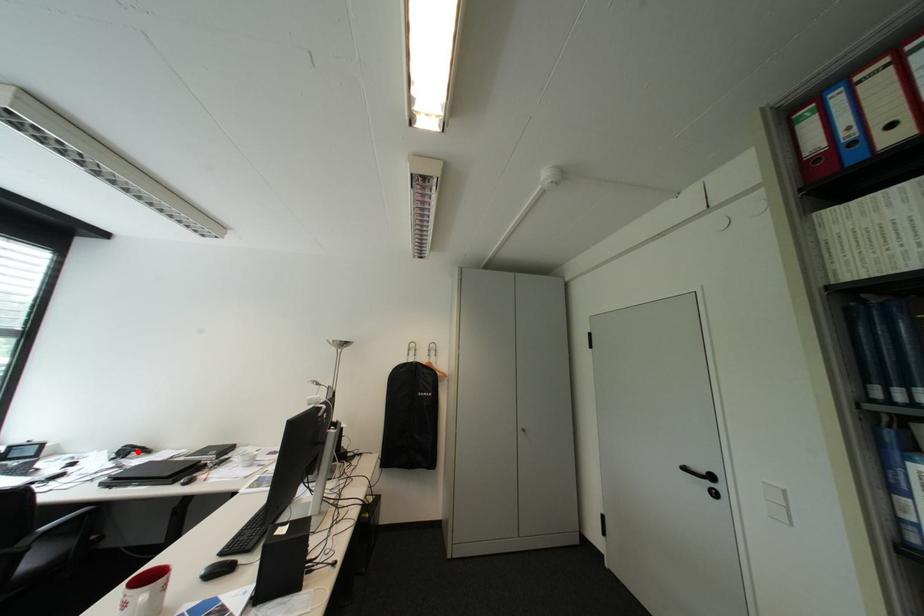
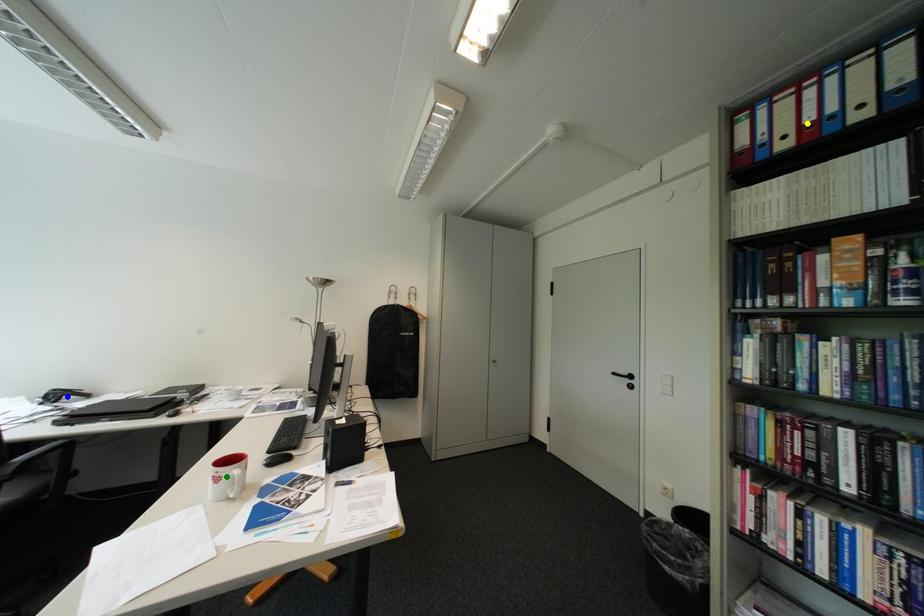
Question: I am providing you with two images of the same scene from different viewpoints. A red point is marked on the first image. You are given multiple points on the second image. Can you choose the point in image 2 that corresponds to the point in image 1?

Choices:
 (A) blue point
 (B) yellow point
 (C) green point

Answer: (A)